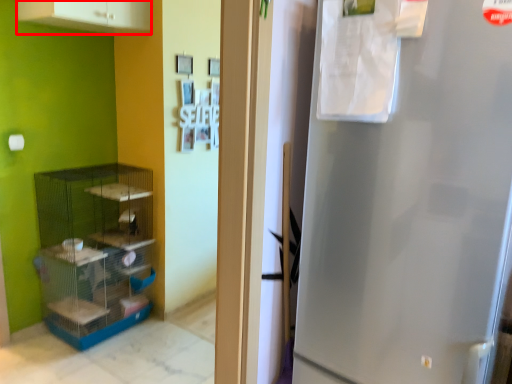
Question: From the image's perspective, where is cabinetry (annotated by the red box) located relative to shelf?

Choices:
 (A) above
 (B) below

Answer: (A)